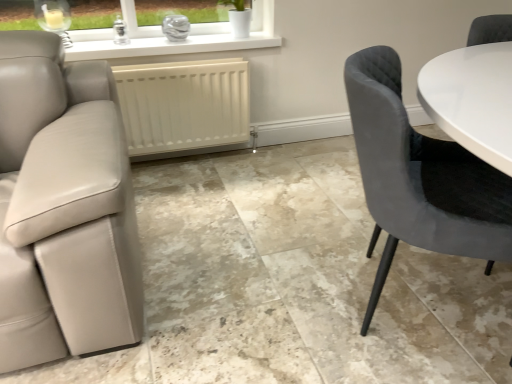
Question: Is the position of velvet grey chair at right less distant than that of white matte radiator at center?

Choices:
 (A) no
 (B) yes

Answer: (B)

Question: Is velvet grey chair at right further to the viewer compared to white matte radiator at center?

Choices:
 (A) no
 (B) yes

Answer: (A)

Question: From a real-world perspective, is velvet grey chair at right under white matte radiator at center?

Choices:
 (A) yes
 (B) no

Answer: (B)

Question: Does velvet grey chair at right appear on the left side of white matte radiator at center?

Choices:
 (A) no
 (B) yes

Answer: (A)

Question: From the image's perspective, is velvet grey chair at right located beneath white matte radiator at center?

Choices:
 (A) yes
 (B) no

Answer: (A)

Question: Is velvet grey chair at right thinner than white matte radiator at center?

Choices:
 (A) no
 (B) yes

Answer: (A)

Question: Does white matte radiator at center lie in front of velvet grey chair at right?

Choices:
 (A) yes
 (B) no

Answer: (B)

Question: Is white matte radiator at center taller than velvet grey chair at right?

Choices:
 (A) no
 (B) yes

Answer: (A)

Question: Is white matte radiator at center aimed at velvet grey chair at right?

Choices:
 (A) no
 (B) yes

Answer: (B)

Question: Is white matte radiator at center surrounding velvet grey chair at right?

Choices:
 (A) no
 (B) yes

Answer: (A)

Question: Considering the relative sizes of white matte radiator at center and velvet grey chair at right in the image provided, is white matte radiator at center shorter than velvet grey chair at right?

Choices:
 (A) yes
 (B) no

Answer: (A)

Question: Is white matte radiator at center bigger than velvet grey chair at right?

Choices:
 (A) no
 (B) yes

Answer: (A)

Question: Is point (497, 210) closer or farther from the camera than point (147, 145)?

Choices:
 (A) closer
 (B) farther

Answer: (A)